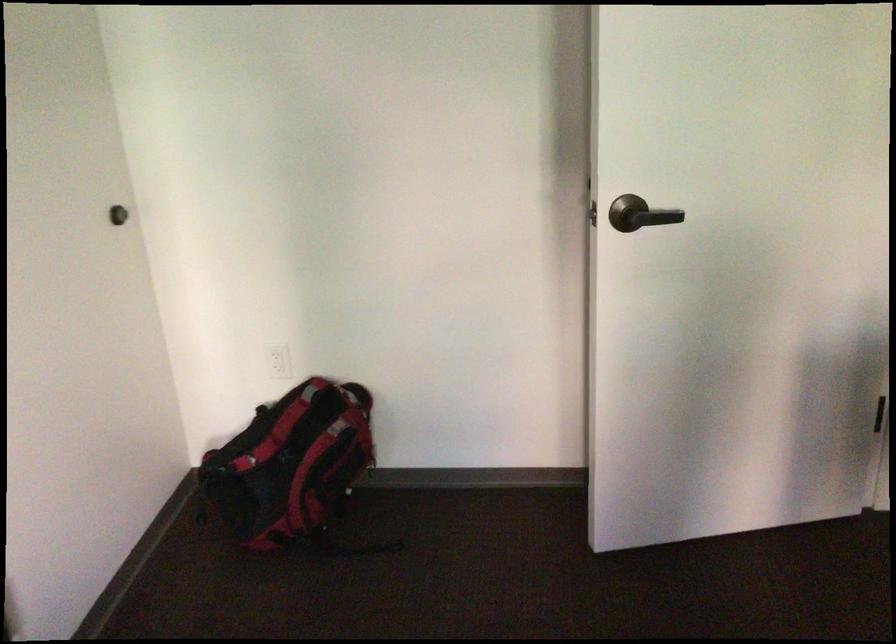
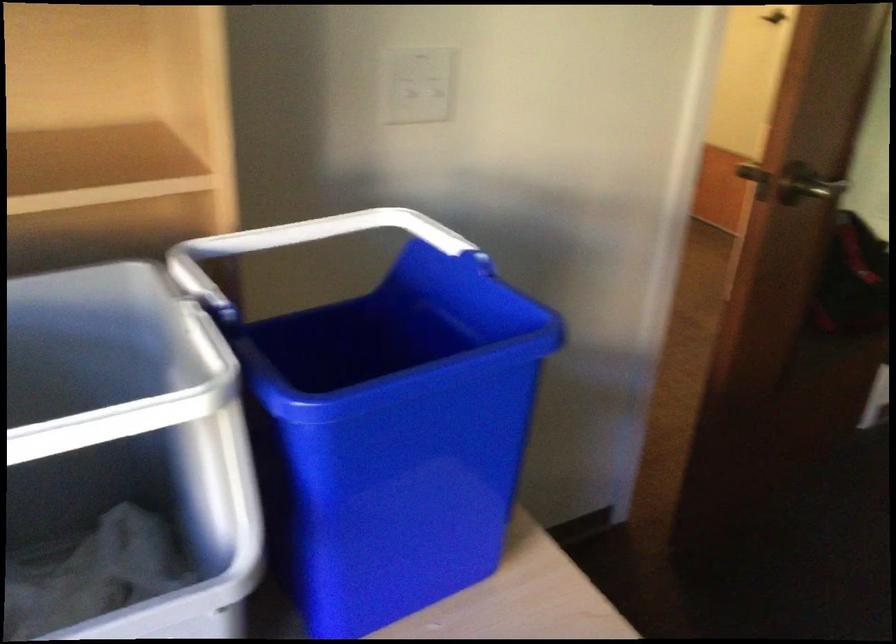
The images are taken continuously from a first-person perspective. In which direction is your viewpoint rotating?

The camera's rotation is toward left-down.